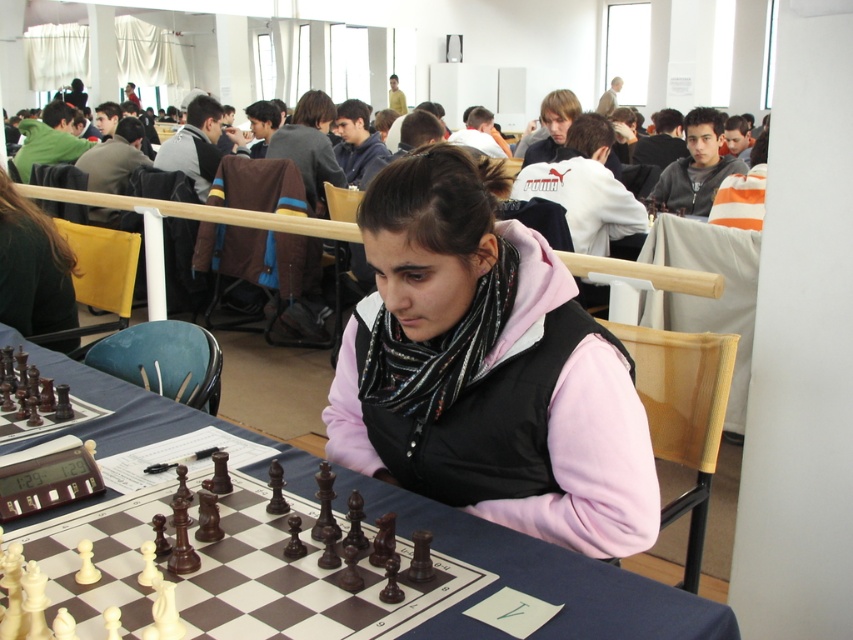
From the picture: Is pink fleece vest at center to the right of black fabric scarf at upper left from the viewer's perspective?

Correct, you'll find pink fleece vest at center to the right of black fabric scarf at upper left.

Does point (436, 296) come in front of point (30, 280)?

Yes, point (436, 296) is closer to viewer.

Locate an element on the screen. This screenshot has height=640, width=853. pink fleece vest at center is located at coordinates (486, 371).

Measure the distance between wooden chess set at center and black fabric scarf at upper left.

wooden chess set at center is 5.20 feet away from black fabric scarf at upper left.

Who is taller, wooden chess set at center or black fabric scarf at upper left?

black fabric scarf at upper left is taller.

Describe the element at coordinates (300, 579) in the screenshot. Image resolution: width=853 pixels, height=640 pixels. I see `wooden chess set at center` at that location.

Where is `wooden chess set at center`? wooden chess set at center is located at coordinates (300, 579).

Between wooden chessboard at center and black fabric scarf at upper left, which one has less height?

Standing shorter between the two is wooden chessboard at center.

Who is higher up, wooden chessboard at center or black fabric scarf at upper left?

black fabric scarf at upper left is higher up.

Is point (160, 401) farther from camera compared to point (51, 252)?

No, (160, 401) is closer to viewer.

The image size is (853, 640). What are the coordinates of `wooden chessboard at center` in the screenshot? It's located at pos(543,579).